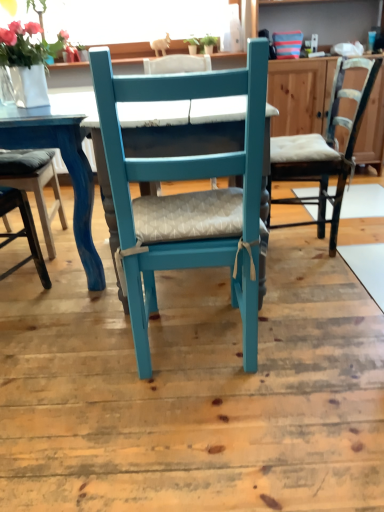
Locate an element on the screen. matte white vase at upper left is located at coordinates [x=27, y=45].

Measure the distance between point (40,119) and camera.

A distance of 1.53 meters exists between point (40,119) and camera.

In order to face matte blue chair at center, the first table when ordered from right to left, should I rotate leftwards or rightwards?

Turn left by 0.441 degrees to look at matte blue chair at center, the first table when ordered from right to left.

This screenshot has width=384, height=512. In order to click on matte white cushioned chair at right, which is the 1th chair in back-to-front order in this screenshot , I will do `click(324, 151)`.

Are matte blue chair at center, which ranks as the 2th table in left-to-right order, and matte blue table at left, the first table viewed from the left, far apart?

No, there isn't a large distance between matte blue chair at center, which ranks as the 2th table in left-to-right order, and matte blue table at left, the first table viewed from the left.

From the image's perspective, is matte blue chair at center, which ranks as the 2th table in left-to-right order, located above or below matte blue table at left, which is the second table from right to left?

Based on their image positions, matte blue chair at center, which ranks as the 2th table in left-to-right order, is located beneath matte blue table at left, which is the second table from right to left.

Does matte blue chair at center, the first table when ordered from right to left, have a lesser width compared to matte blue table at left, the first table viewed from the left?

Incorrect, the width of matte blue chair at center, the first table when ordered from right to left, is not less than that of matte blue table at left, the first table viewed from the left.

Considering the relative sizes of matte blue chair at center, the first table when ordered from right to left, and matte blue table at left, which is the second table from right to left, in the image provided, is matte blue chair at center, the first table when ordered from right to left, taller than matte blue table at left, which is the second table from right to left,?

No, matte blue chair at center, the first table when ordered from right to left, is not taller than matte blue table at left, which is the second table from right to left.

Would you say matte white vase at upper left contains matte white cushioned chair at right, which is counted as the second chair, starting from the front?

No, matte white cushioned chair at right, which is counted as the second chair, starting from the front, is not surrounded by matte white vase at upper left.

Which point is more distant from viewer, (21,60) or (279,169)?

The point (279,169) is behind.

Considering the sizes of objects matte white vase at upper left and matte white cushioned chair at right, which is counted as the second chair, starting from the front, in the image provided, who is bigger, matte white vase at upper left or matte white cushioned chair at right, which is counted as the second chair, starting from the front,?

Bigger between the two is matte white cushioned chair at right, which is counted as the second chair, starting from the front.

Could you tell me if matte white vase at upper left is facing matte white cushioned chair at right, the 1th chair when ordered from right to left?

No, matte white vase at upper left is not aimed at matte white cushioned chair at right, the 1th chair when ordered from right to left.

Is teal painted wood chair at center, the second chair in the right-to-left sequence, facing towards matte white cushioned chair at right, marked as the 2th chair in a left-to-right arrangement?

No.

Is teal painted wood chair at center, the second chair in the right-to-left sequence, in front of or behind matte white cushioned chair at right, the 1th chair when ordered from right to left, in the image?

In the image, teal painted wood chair at center, the second chair in the right-to-left sequence, appears in front of matte white cushioned chair at right, the 1th chair when ordered from right to left.

Between teal painted wood chair at center, the first chair positioned from the left, and matte white cushioned chair at right, marked as the 2th chair in a left-to-right arrangement, which one appears on the left side from the viewer's perspective?

teal painted wood chair at center, the first chair positioned from the left, is more to the left.

Considering the positions of point (225, 213) and point (319, 182), is point (225, 213) closer or farther from the camera than point (319, 182)?

Clearly, point (225, 213) is closer to the camera than point (319, 182).

Could you tell me if teal painted wood chair at center, the second chair in the right-to-left sequence, is facing matte blue chair at center, which ranks as the 2th table in left-to-right order?

Yes, teal painted wood chair at center, the second chair in the right-to-left sequence, is facing matte blue chair at center, which ranks as the 2th table in left-to-right order.

Considering the sizes of objects teal painted wood chair at center, the first chair positioned from the left, and matte blue chair at center, the first table when ordered from right to left, in the image provided, who is thinner, teal painted wood chair at center, the first chair positioned from the left, or matte blue chair at center, the first table when ordered from right to left,?

Thinner between the two is teal painted wood chair at center, the first chair positioned from the left.

Considering the relative sizes of teal painted wood chair at center, the second chair in the right-to-left sequence, and matte blue chair at center, the first table when ordered from right to left, in the image provided, is teal painted wood chair at center, the second chair in the right-to-left sequence, shorter than matte blue chair at center, the first table when ordered from right to left,?

In fact, teal painted wood chair at center, the second chair in the right-to-left sequence, may be taller than matte blue chair at center, the first table when ordered from right to left.

In the scene shown: Does matte blue table at left, the first table viewed from the left, lie behind matte white vase at upper left?

No, it is not.

Is matte blue table at left, which is the second table from right to left, directly adjacent to matte white vase at upper left?

No, matte blue table at left, which is the second table from right to left, is not touching matte white vase at upper left.

Considering the sizes of objects matte blue table at left, which is the second table from right to left, and matte white vase at upper left in the image provided, who is thinner, matte blue table at left, which is the second table from right to left, or matte white vase at upper left?

Thinner between the two is matte white vase at upper left.

Is matte blue table at left, which is the second table from right to left, inside or outside of matte white vase at upper left?

matte blue table at left, which is the second table from right to left, cannot be found inside matte white vase at upper left.

Does point (84, 183) lie in front of point (174, 147)?

No, it is behind (174, 147).

Can you confirm if matte blue table at left, which is the second table from right to left, is thinner than matte blue chair at center, the first table when ordered from right to left?

Correct, the width of matte blue table at left, which is the second table from right to left, is less than that of matte blue chair at center, the first table when ordered from right to left.

How different are the orientations of matte blue table at left, the first table viewed from the left, and matte blue chair at center, which ranks as the 2th table in left-to-right order, in degrees?

The angular difference between matte blue table at left, the first table viewed from the left, and matte blue chair at center, which ranks as the 2th table in left-to-right order, is 2.95 degrees.

In the scene shown: Which object is positioned more to the right, matte blue table at left, which is the second table from right to left, or matte blue chair at center, the first table when ordered from right to left?

matte blue chair at center, the first table when ordered from right to left.

Is matte white cushioned chair at right, which is the 1th chair in back-to-front order, oriented away from teal painted wood chair at center, the second chair in the right-to-left sequence?

No, matte white cushioned chair at right, which is the 1th chair in back-to-front order, is not facing away from teal painted wood chair at center, the second chair in the right-to-left sequence.

Is matte white cushioned chair at right, which is counted as the second chair, starting from the front, bigger than teal painted wood chair at center, the second chair in the right-to-left sequence?

No, matte white cushioned chair at right, which is counted as the second chair, starting from the front, is not bigger than teal painted wood chair at center, the second chair in the right-to-left sequence.

Are matte white cushioned chair at right, the 1th chair when ordered from right to left, and teal painted wood chair at center, which is the second chair from back to front, located far from each other?

No, matte white cushioned chair at right, the 1th chair when ordered from right to left, is not far from teal painted wood chair at center, which is the second chair from back to front.

The height and width of the screenshot is (512, 384). I want to click on chair located on the left of matte white cushioned chair at right, the 1th chair when ordered from right to left, so click(x=187, y=195).

Locate an element on the screen. This screenshot has height=512, width=384. table located below the matte blue table at left, which is the second table from right to left (from the image's perspective) is located at coordinates (208, 125).

This screenshot has height=512, width=384. In order to click on flower located on the left of matte white cushioned chair at right, which is counted as the second chair, starting from the front in this screenshot , I will do `click(27, 45)`.

Looking at this image, considering their positions, is matte white vase at upper left positioned closer to matte blue chair at center, which ranks as the 2th table in left-to-right order, than matte blue table at left, the first table viewed from the left?

Among the two, matte blue table at left, the first table viewed from the left, is located nearer to matte blue chair at center, which ranks as the 2th table in left-to-right order.

Looking at the image, which one is located closer to matte white cushioned chair at right, marked as the 2th chair in a left-to-right arrangement, matte blue chair at center, which ranks as the 2th table in left-to-right order, or matte blue table at left, the first table viewed from the left?

matte blue table at left, the first table viewed from the left, lies closer to matte white cushioned chair at right, marked as the 2th chair in a left-to-right arrangement, than the other object.

Estimate the real-world distances between objects in this image. Which object is further from teal painted wood chair at center, which is the second chair from back to front, matte blue table at left, the first table viewed from the left, or matte white cushioned chair at right, which is the 1th chair in back-to-front order?

matte white cushioned chair at right, which is the 1th chair in back-to-front order, is positioned further to the anchor teal painted wood chair at center, which is the second chair from back to front.

Estimate the real-world distances between objects in this image. Which object is further from matte blue table at left, the first table viewed from the left, teal painted wood chair at center, the first chair positioned from the left, or matte blue chair at center, the first table when ordered from right to left?

teal painted wood chair at center, the first chair positioned from the left, is further to matte blue table at left, the first table viewed from the left.

When comparing their distances from matte white cushioned chair at right, which is counted as the second chair, starting from the front, does matte blue table at left, the first table viewed from the left, or matte white vase at upper left seem further?

matte white vase at upper left.

Based on their spatial positions, is matte blue chair at center, the first table when ordered from right to left, or teal painted wood chair at center, the first chair positioned from the left, closer to matte white cushioned chair at right, marked as the 2th chair in a left-to-right arrangement?

teal painted wood chair at center, the first chair positioned from the left, is closer to matte white cushioned chair at right, marked as the 2th chair in a left-to-right arrangement.

When comparing their distances from matte white cushioned chair at right, marked as the 2th chair in a left-to-right arrangement, does matte blue table at left, the first table viewed from the left, or teal painted wood chair at center, the first chair positioned from the left, seem closer?

teal painted wood chair at center, the first chair positioned from the left.

Based on their spatial positions, is matte blue table at left, the first table viewed from the left, or matte white vase at upper left closer to teal painted wood chair at center, the 1th chair from the front?

The object closer to teal painted wood chair at center, the 1th chair from the front, is matte blue table at left, the first table viewed from the left.

Where is `table between matte blue table at left, which is the second table from right to left, and matte white cushioned chair at right, which is the 1th chair in back-to-front order, from left to right`? Image resolution: width=384 pixels, height=512 pixels. table between matte blue table at left, which is the second table from right to left, and matte white cushioned chair at right, which is the 1th chair in back-to-front order, from left to right is located at coordinates (208, 125).

What are the coordinates of `table positioned between matte blue chair at center, the first table when ordered from right to left, and matte white vase at upper left from near to far` in the screenshot? It's located at (67, 168).

Locate an element on the screen. chair between matte blue table at left, the first table viewed from the left, and matte white cushioned chair at right, marked as the 2th chair in a left-to-right arrangement, from left to right is located at coordinates coord(187,195).

Identify the location of table situated between matte blue table at left, which is the second table from right to left, and teal painted wood chair at center, which is the second chair from back to front, from left to right. Image resolution: width=384 pixels, height=512 pixels. (208, 125).